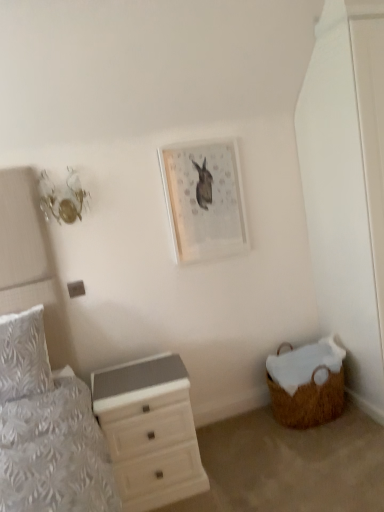
Question: Should I look upward or downward to see white glossy chest of drawers at lower left?

Choices:
 (A) down
 (B) up

Answer: (A)

Question: Does matte white picture frame at upper center have a greater width compared to white textured pillow at left?

Choices:
 (A) no
 (B) yes

Answer: (A)

Question: From the image's perspective, is matte white picture frame at upper center located beneath white textured pillow at left?

Choices:
 (A) no
 (B) yes

Answer: (A)

Question: Is matte white picture frame at upper center far from white textured pillow at left?

Choices:
 (A) yes
 (B) no

Answer: (A)

Question: From a real-world perspective, is matte white picture frame at upper center physically below white textured pillow at left?

Choices:
 (A) yes
 (B) no

Answer: (B)

Question: Is the depth of matte white picture frame at upper center greater than that of white textured pillow at left?

Choices:
 (A) no
 (B) yes

Answer: (B)

Question: Is matte white picture frame at upper center in contact with white textured pillow at left?

Choices:
 (A) no
 (B) yes

Answer: (A)

Question: Considering the relative positions of white textured pillow at left and woven brown basket at lower right in the image provided, is white textured pillow at left to the left of woven brown basket at lower right from the viewer's perspective?

Choices:
 (A) yes
 (B) no

Answer: (A)

Question: Is white textured pillow at left further to the viewer compared to woven brown basket at lower right?

Choices:
 (A) no
 (B) yes

Answer: (A)

Question: Can you confirm if white textured pillow at left is positioned to the right of woven brown basket at lower right?

Choices:
 (A) no
 (B) yes

Answer: (A)

Question: From the image's perspective, is white textured pillow at left on top of woven brown basket at lower right?

Choices:
 (A) no
 (B) yes

Answer: (B)

Question: Is white textured pillow at left completely or partially outside of woven brown basket at lower right?

Choices:
 (A) yes
 (B) no

Answer: (A)

Question: From a real-world perspective, is white textured pillow at left positioned over woven brown basket at lower right based on gravity?

Choices:
 (A) no
 (B) yes

Answer: (B)

Question: Is white textured pillow at left at the right side of matte white picture frame at upper center?

Choices:
 (A) no
 (B) yes

Answer: (A)